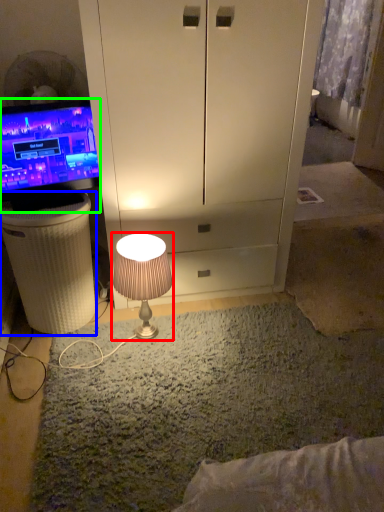
Question: Based on their relative distances, which object is nearer to lamp (highlighted by a red box)? Choose from vanity (highlighted by a blue box) and television (highlighted by a green box).

Choices:
 (A) vanity
 (B) television

Answer: (A)